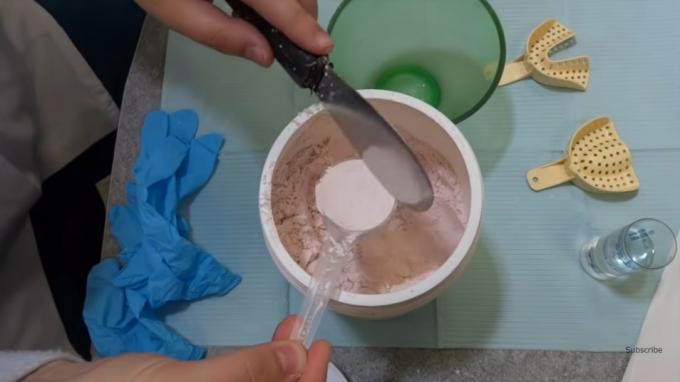
The width and height of the screenshot is (680, 382). I want to click on sheet, so click(526, 291).